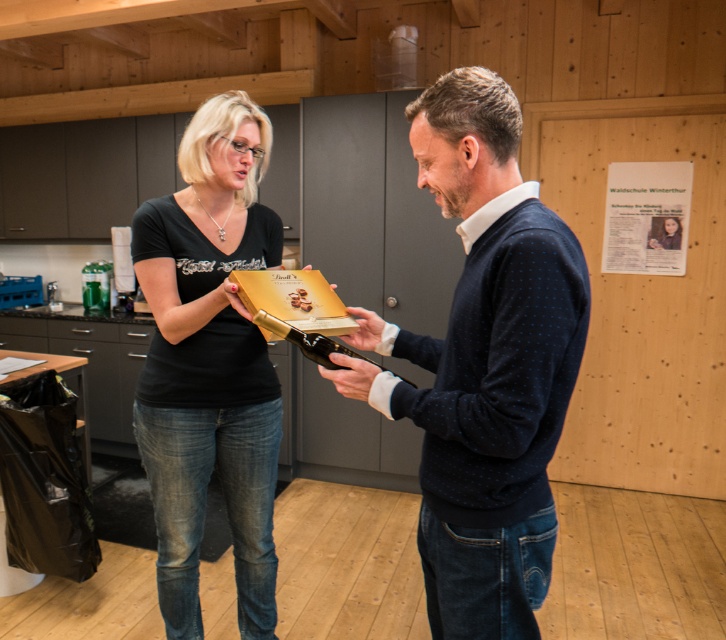
Question: Is matte gold box at center bigger than matte black shirt at center?

Choices:
 (A) yes
 (B) no

Answer: (B)

Question: From the image, what is the correct spatial relationship of matte gold box at center in relation to matte black shirt at center?

Choices:
 (A) above
 (B) below

Answer: (A)

Question: Does matte gold box at center have a greater width compared to matte black shirt at center?

Choices:
 (A) yes
 (B) no

Answer: (A)

Question: Which point appears closest to the camera in this image?

Choices:
 (A) (393, 376)
 (B) (134, 218)

Answer: (A)

Question: Which point appears closest to the camera in this image?

Choices:
 (A) (224, 451)
 (B) (371, 316)

Answer: (B)